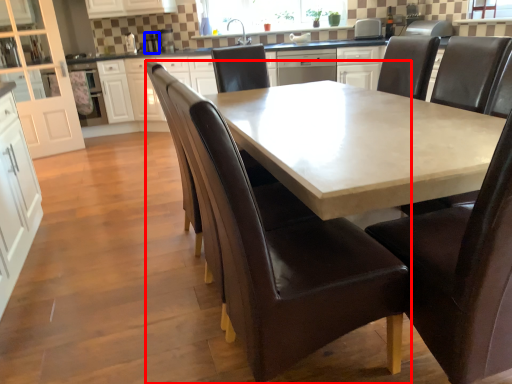
Question: Which object is closer to the camera taking this photo, chair (highlighted by a red box) or appliance (highlighted by a blue box)?

Choices:
 (A) chair
 (B) appliance

Answer: (A)